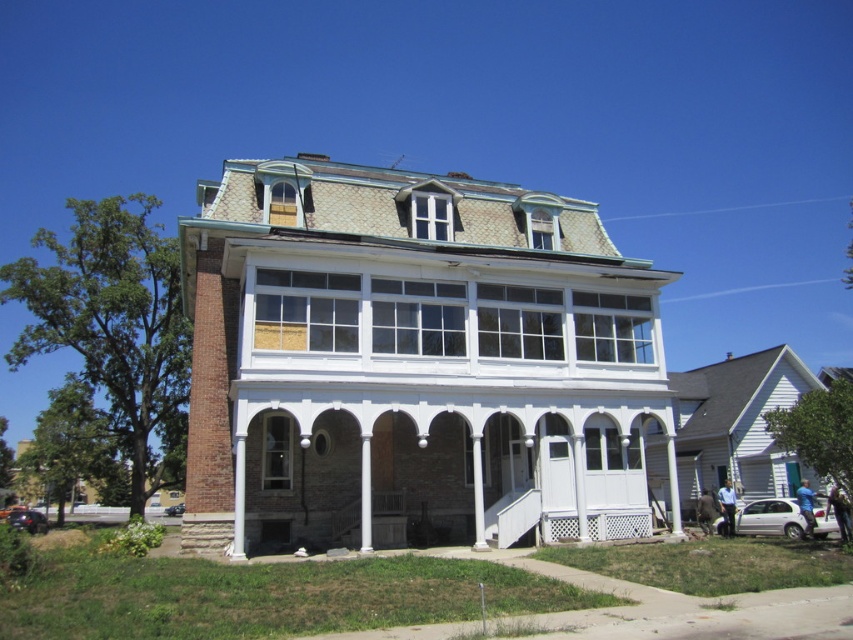
Question: Which point is closer to the camera taking this photo?

Choices:
 (A) (19, 513)
 (B) (178, 502)

Answer: (A)

Question: Which object is farther from the camera taking this photo?

Choices:
 (A) metallic orange car at lower left
 (B) metallic silver sedan at lower left
 (C) white matte sedan at lower right
 (D) white painted wood pillar at center

Answer: (B)

Question: Does white painted wood pillar at center appear on the left side of metallic silver sedan at lower left?

Choices:
 (A) yes
 (B) no

Answer: (B)

Question: Which point appears farthest from the camera in this image?

Choices:
 (A) (822, 538)
 (B) (164, 513)
 (C) (372, 509)

Answer: (B)

Question: Does white painted wood pillar at center appear over metallic orange car at lower left?

Choices:
 (A) yes
 (B) no

Answer: (A)

Question: Is white painted wood pillar at center closer to the viewer compared to metallic silver sedan at lower left?

Choices:
 (A) yes
 (B) no

Answer: (A)